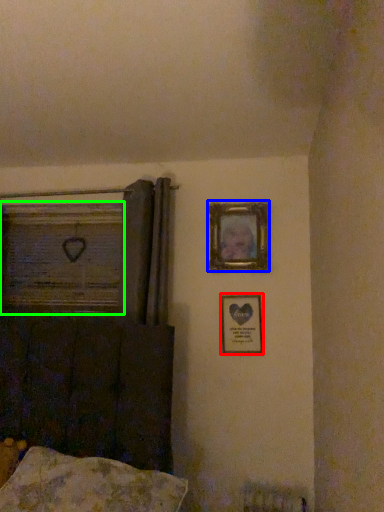
Question: Which object is the closest to the picture frame (highlighted by a red box)? Choose among these: picture frame (highlighted by a blue box) or window frame (highlighted by a green box).

Choices:
 (A) picture frame
 (B) window frame

Answer: (A)